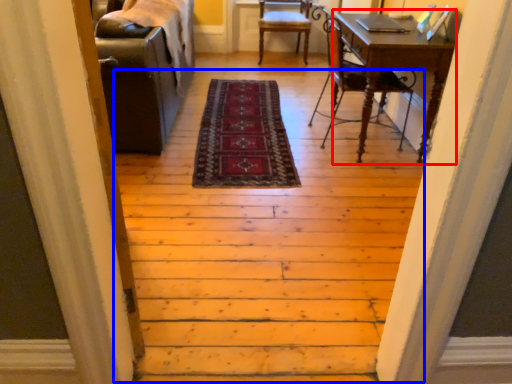
Question: Which object appears closest to the camera in this image, computer desk (highlighted by a red box) or stairwell (highlighted by a blue box)?

Choices:
 (A) computer desk
 (B) stairwell

Answer: (B)